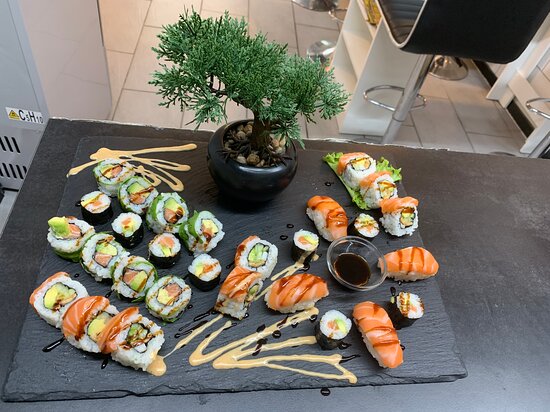
Where is `green bonsai tree`? This screenshot has width=550, height=412. green bonsai tree is located at coordinates (273, 77).